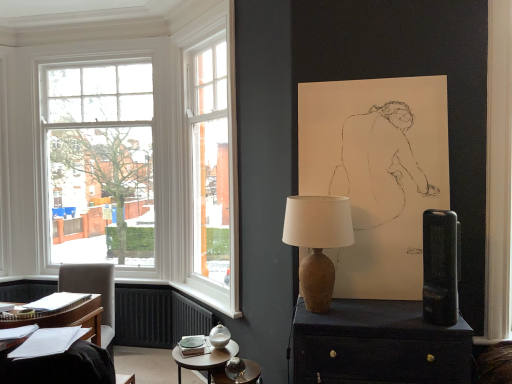
In order to click on vacant space to the right of brown ceramic lamp at center in this screenshot , I will do `click(384, 321)`.